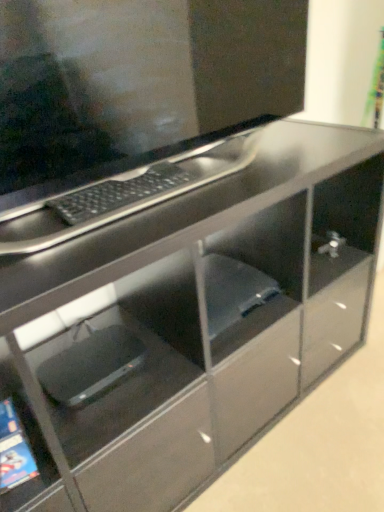
Locate an element on the screen. This screenshot has height=512, width=384. vacant region in front of black matte keyboard at upper center is located at coordinates (114, 231).